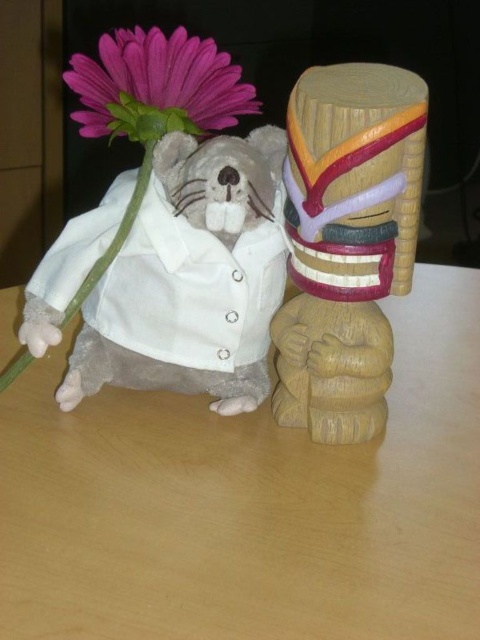
You are setting up a small display on a table and need to place a 6.5 inch wide decorative plate between the fluffy gray teddy bear at left and the wooden mask at center. Based on the given information, will the plate fit between them without overlapping either object?

The distance between the fluffy gray teddy bear at left and the wooden mask at center is 5.10 inches. Since the plate is 6.5 inches wide, it is wider than the available space. Therefore, the plate will not fit between them without overlapping.

You are organizing a small picnic and need to place both the wooden table at center and the fluffy gray teddy bear at left on a 1.2 meter wide blanket. Given their sizes, can both items fit side by side on the blanket without overlapping?

The wooden table at center is wider than the fluffy gray teddy bear at left. However, since the exact widths are not provided, we cannot determine if they can fit side by side on the 1.2 meter wide blanket.